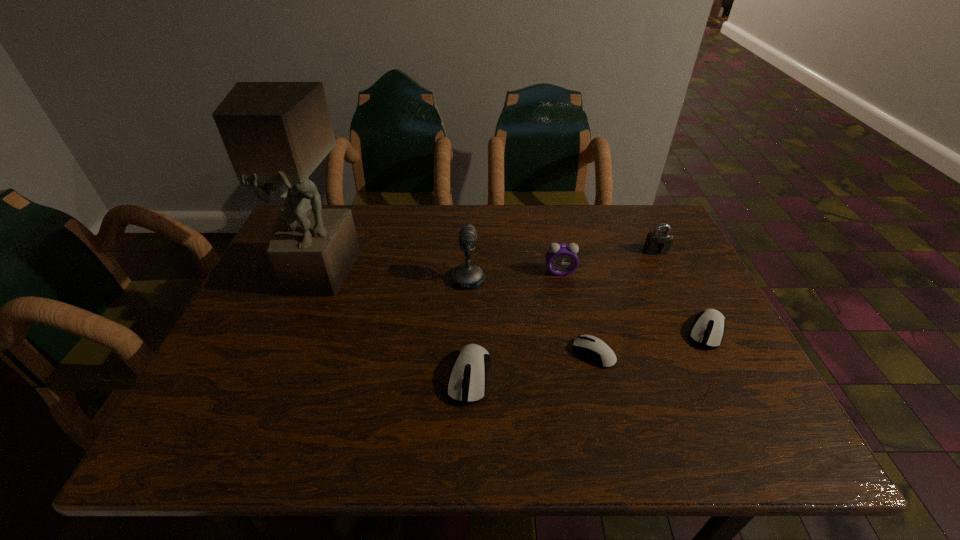
The image size is (960, 540). In order to click on object that can be found as the third closest to the tallest mouse in this screenshot , I will do `click(561, 259)`.

Where is `object identified as the third closest to the microphone`? object identified as the third closest to the microphone is located at coordinates (595, 349).

The image size is (960, 540). I want to click on mouse that stands as the third closest to the alarm clock, so click(467, 381).

Identify the location of mouse that is the second closest to the alarm clock. Image resolution: width=960 pixels, height=540 pixels. (708, 329).

Locate an element on the screen. vacant region that satisfies the following two spatial constraints: 1. on the face of the shortest mouse; 2. on the right side of the alarm clock is located at coordinates (x=576, y=353).

Find the location of `vacant position in the image that satisfies the following two spatial constraints: 1. on the front-facing side of the second mouse from right to left; 2. on the left side of the leftmost object`. vacant position in the image that satisfies the following two spatial constraints: 1. on the front-facing side of the second mouse from right to left; 2. on the left side of the leftmost object is located at coordinates (287, 353).

Find the location of a particular element. The image size is (960, 540). vacant region that satisfies the following two spatial constraints: 1. on the front-facing side of the sculpture; 2. on the left side of the leftmost mouse is located at coordinates (277, 376).

Locate an element on the screen. vacant region that satisfies the following two spatial constraints: 1. on the back side of the fifth tallest object; 2. on the right side of the second mouse from left to right is located at coordinates (470, 353).

Identify the location of free location that satisfies the following two spatial constraints: 1. at the front of the padlock near the keyhole; 2. on the left side of the rightmost mouse. The height and width of the screenshot is (540, 960). (694, 332).

At what (x,y) coordinates should I click in order to perform the action: click on vacant area that satisfies the following two spatial constraints: 1. on the front-facing side of the microphone; 2. on the left side of the tallest mouse. Please return your answer as a coordinate pair (x, y). The height and width of the screenshot is (540, 960). Looking at the image, I should click on (465, 376).